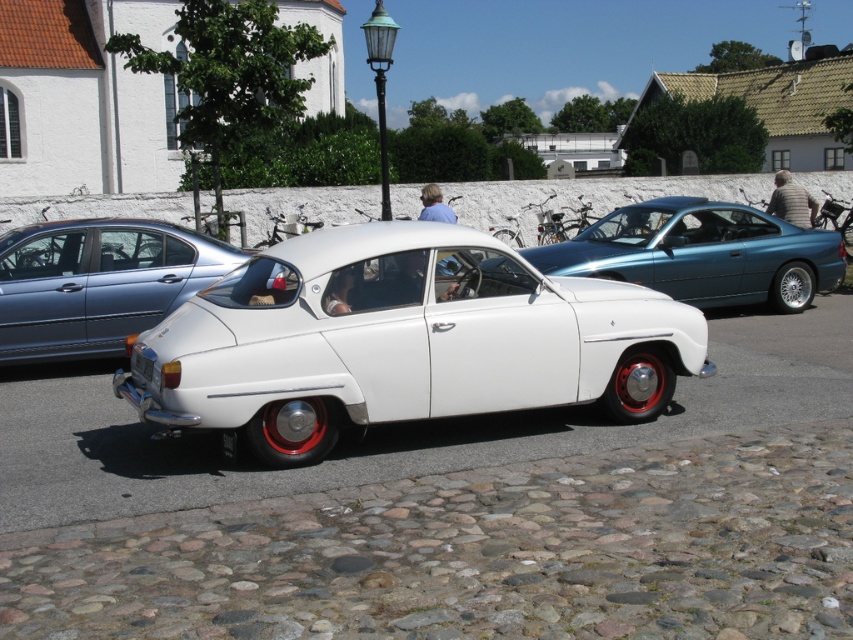
Between white matte car at center and metallic blue car at center, which one is positioned lower?

white matte car at center is below.

Does point (18, 348) come closer to viewer compared to point (686, 282)?

Yes, point (18, 348) is in front of point (686, 282).

Is point (160, 275) more distant than point (633, 250)?

No, (160, 275) is closer to viewer.

Identify the location of white matte car at center. (97, 282).

What do you see at coordinates (403, 340) in the screenshot?
I see `white glossy car at center` at bounding box center [403, 340].

Identify the location of white glossy car at center. (403, 340).

Does point (624, 275) come farther from viewer compared to point (229, 442)?

That is True.

Between metallic blue car at center and black plastic license plate at rear, which one appears on the left side from the viewer's perspective?

Positioned to the left is black plastic license plate at rear.

Image resolution: width=853 pixels, height=640 pixels. I want to click on metallic blue car at center, so click(701, 253).

Where is `metallic blue car at center`? metallic blue car at center is located at coordinates (701, 253).